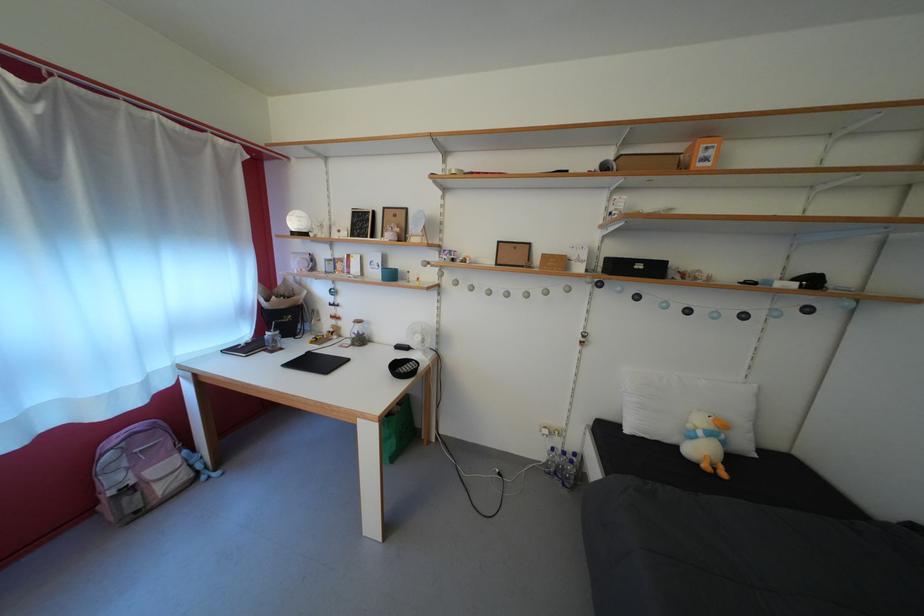
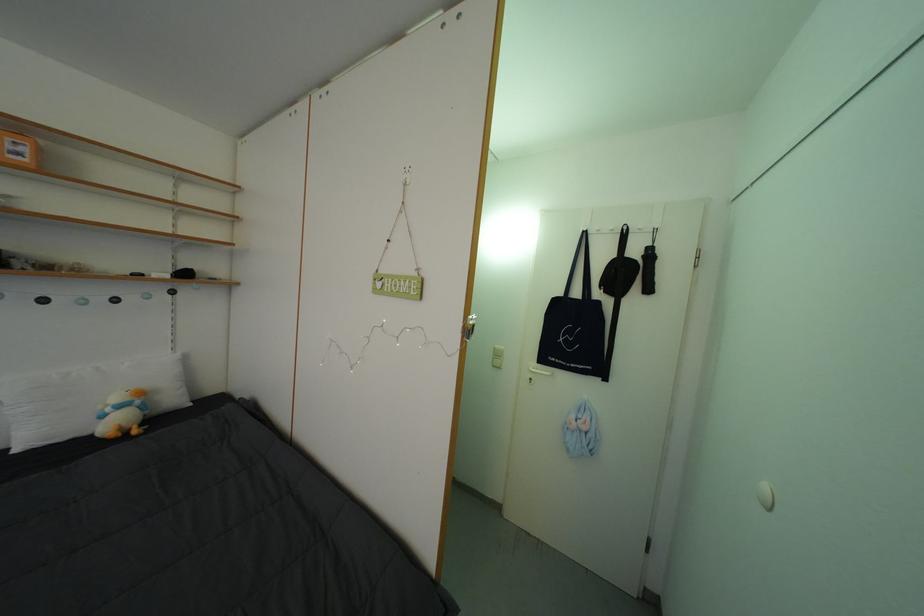
Locate, in the second image, the point that corresponds to (732,448) in the first image.

(152, 413)